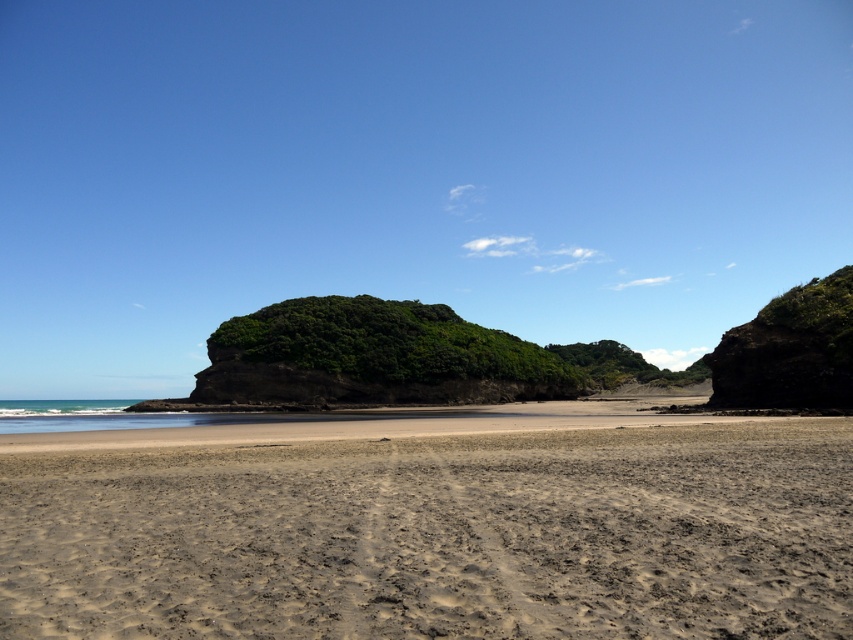
You are standing on the brown sandy beach at center and want to reach the dark brown rocky cliff at right. Which direction should you walk to get closer to the cliff?

You should walk towards the right side of the image because the dark brown rocky cliff at right is located to the right of the brown sandy beach at center.

You are standing at the point with coordinates (x=439, y=536) in the coastal landscape. Which feature of the scene are you most likely standing on?

The point at coordinates (x=439, y=536) corresponds to the brown sandy beach at center.